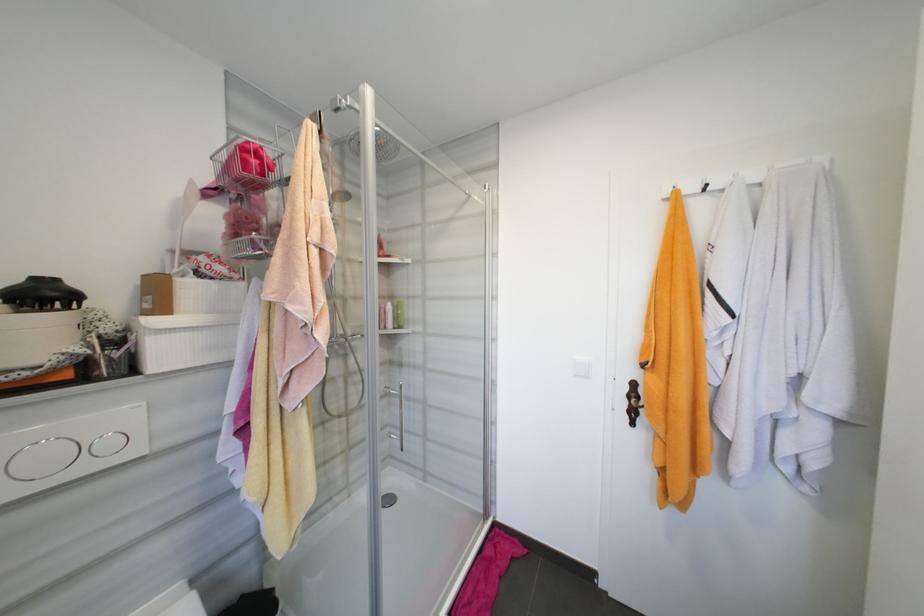
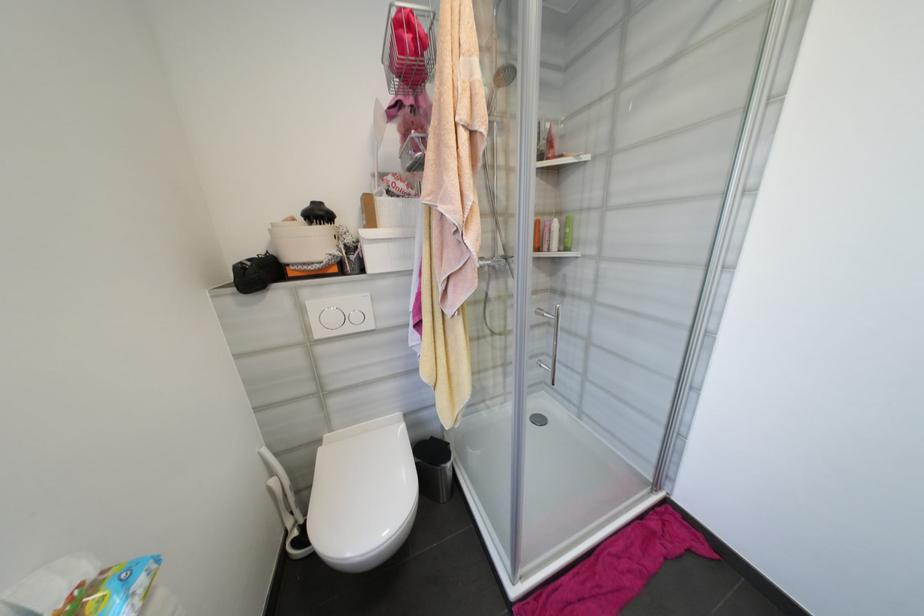
In the second image, find the point that corresponds to [337,249] in the first image.

(488, 127)